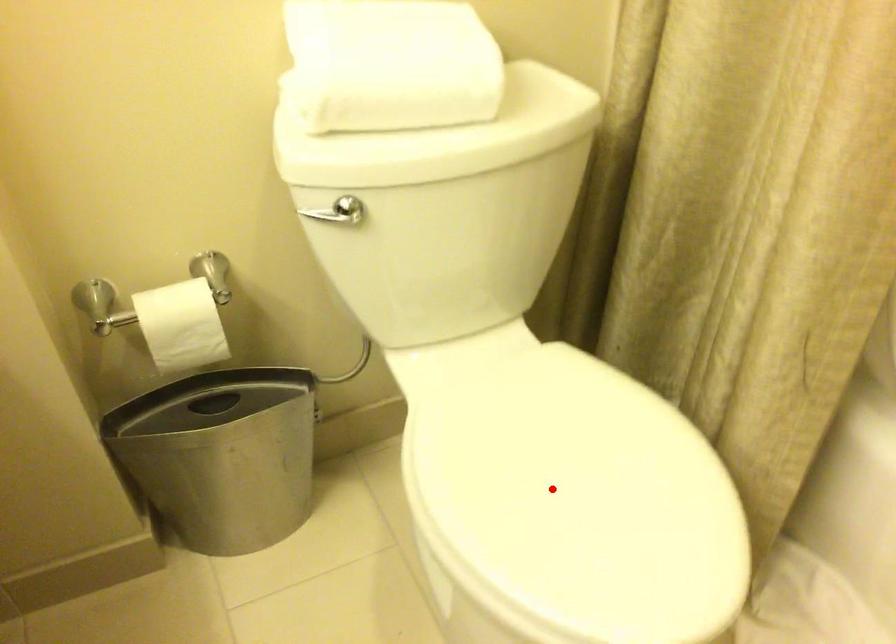
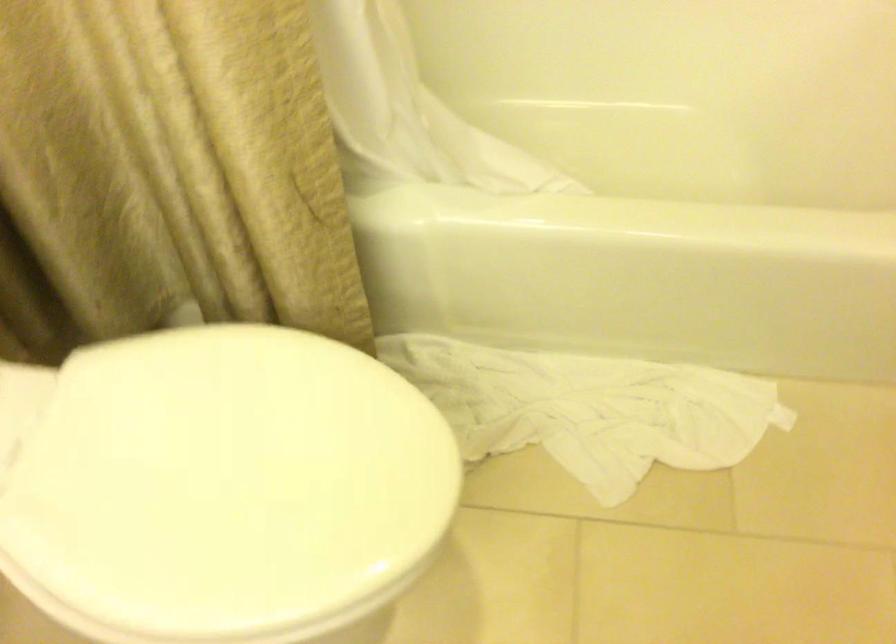
In the second image, find the point that corresponds to the highlighted location in the first image.

(219, 484)